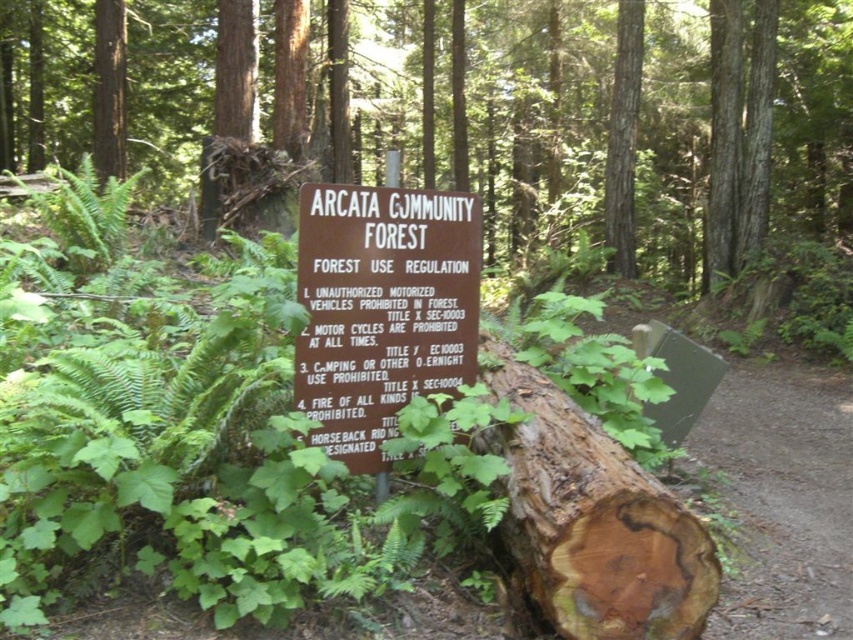
Between brown wooden sign at center and brown rough bark log at center, which one appears on the right side from the viewer's perspective?

brown rough bark log at center is more to the right.

Which is in front, point (434, 252) or point (647, 586)?

Point (647, 586) is more forward.

Between point (465, 248) and point (612, 445), which one is positioned in front?

Point (612, 445) is more forward.

The height and width of the screenshot is (640, 853). Identify the location of brown wooden sign at center. 381,308.

Is rough bark log at center bigger than brown wooden sign at center?

Indeed, rough bark log at center has a larger size compared to brown wooden sign at center.

Does point (50, 134) come in front of point (457, 282)?

No, it is behind (457, 282).

This screenshot has height=640, width=853. What are the coordinates of `rough bark log at center` in the screenshot? It's located at (538, 104).

Can you confirm if rough bark log at center is positioned above brown rough bark log at center?

Indeed, rough bark log at center is positioned over brown rough bark log at center.

Identify the location of rough bark log at center. (538, 104).